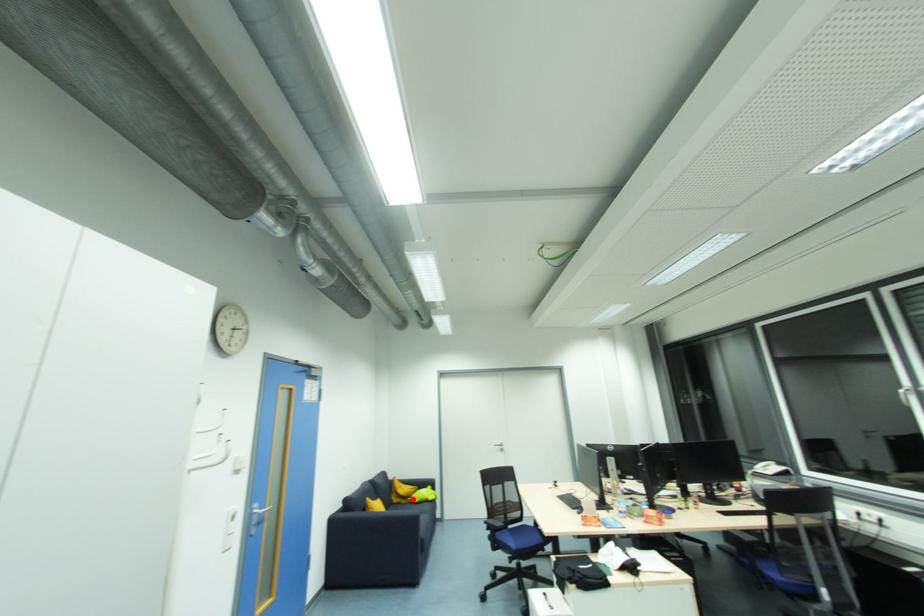
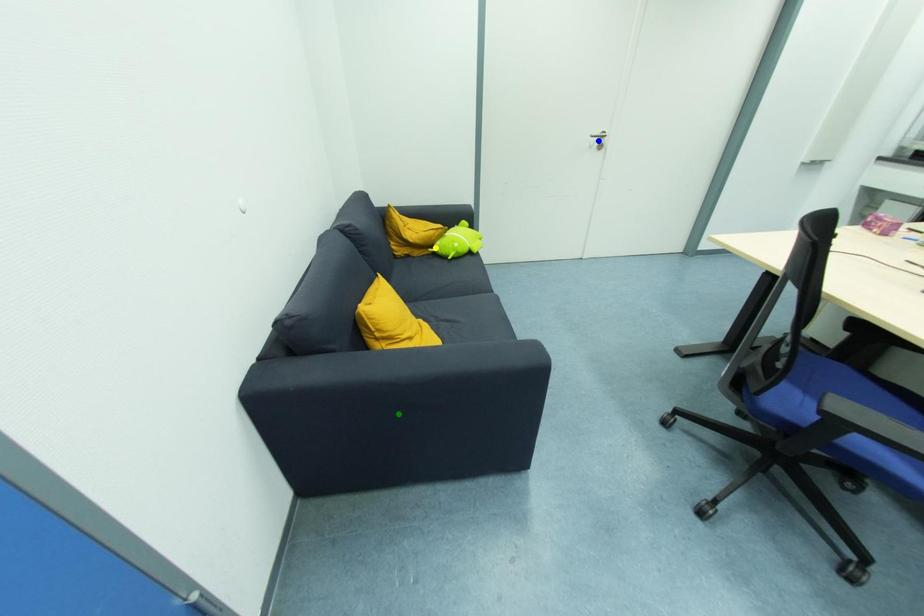
Question: I am providing you with two images of the same scene from different viewpoints. A red point is marked on the first image. You are given multiple points on the second image. Which mark in image 2 goes with the point in image 1?

Choices:
 (A) blue point
 (B) green point
 (C) yellow point

Answer: (C)